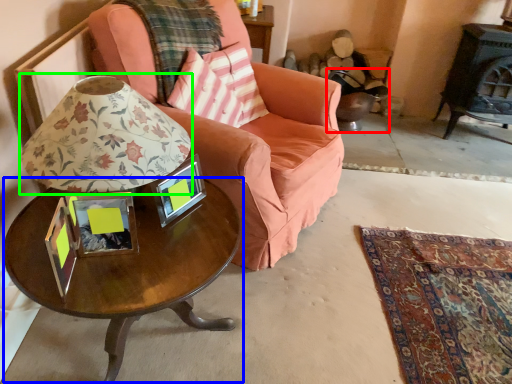
Question: Which is nearer to the swivel chair (highlighted by a red box)? coffee table (highlighted by a blue box) or table lamp (highlighted by a green box).

Choices:
 (A) coffee table
 (B) table lamp

Answer: (A)